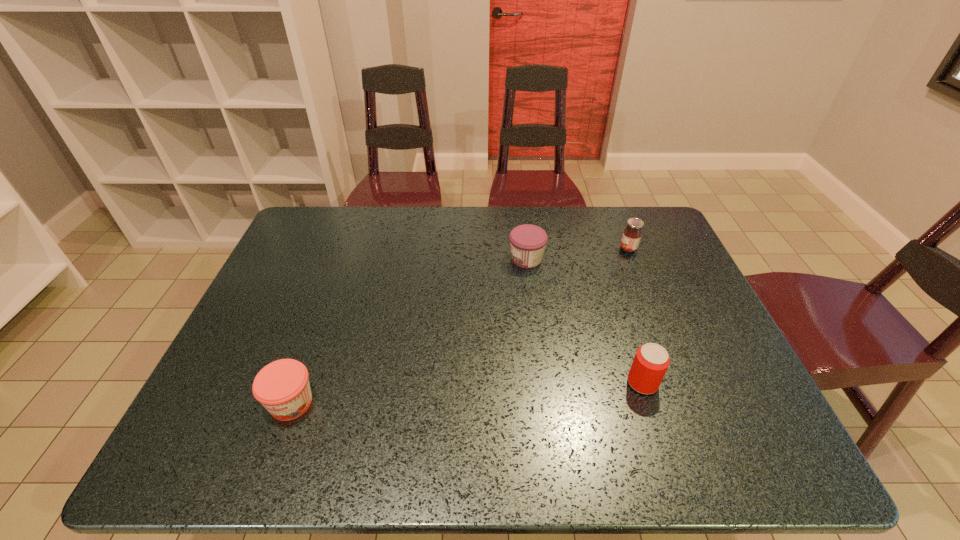
At what (x,y) coordinates should I click in order to perform the action: click on vacant region between the third object from left to right and the second object from left to right. Please return your answer as a coordinate pair (x, y). Image resolution: width=960 pixels, height=540 pixels. Looking at the image, I should click on (585, 321).

Point out which object is positioned as the nearest to the nearest jam. Please provide its 2D coordinates. Your answer should be formatted as a tuple, i.e. [(x, y)], where the tuple contains the x and y coordinates of a point satisfying the conditions above.

[(527, 241)]

The width and height of the screenshot is (960, 540). Find the location of `object that is the closest to the rightmost jam`. object that is the closest to the rightmost jam is located at coordinates (527, 241).

In order to click on the second closest jam to the nearest jam in this screenshot , I will do click(632, 234).

Where is `the second closest jam to the rightmost object`? the second closest jam to the rightmost object is located at coordinates (282, 387).

Identify the location of free space that satisfies the following two spatial constraints: 1. on the front label of the second object from right to left; 2. on the right side of the third object from right to left. Image resolution: width=960 pixels, height=540 pixels. (541, 383).

The image size is (960, 540). What are the coordinates of `vacant space that satisfies the following two spatial constraints: 1. on the front label of the second object from left to right; 2. on the front label of the leftmost jam` in the screenshot? It's located at (544, 403).

Locate an element on the screen. The width and height of the screenshot is (960, 540). free space that satisfies the following two spatial constraints: 1. on the front label of the third object from right to left; 2. on the back side of the beer can is located at coordinates (541, 383).